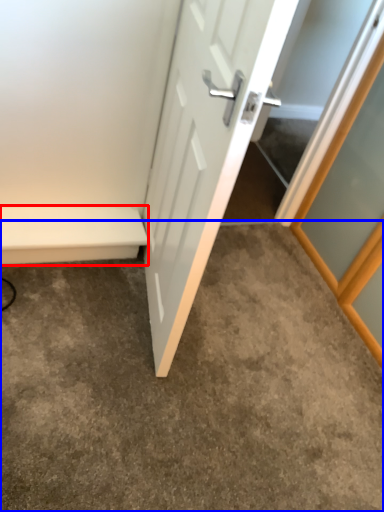
Question: Which point is closer to the camera, balustrade (highlighted by a red box) or concrete (highlighted by a blue box)?

Choices:
 (A) balustrade
 (B) concrete

Answer: (B)